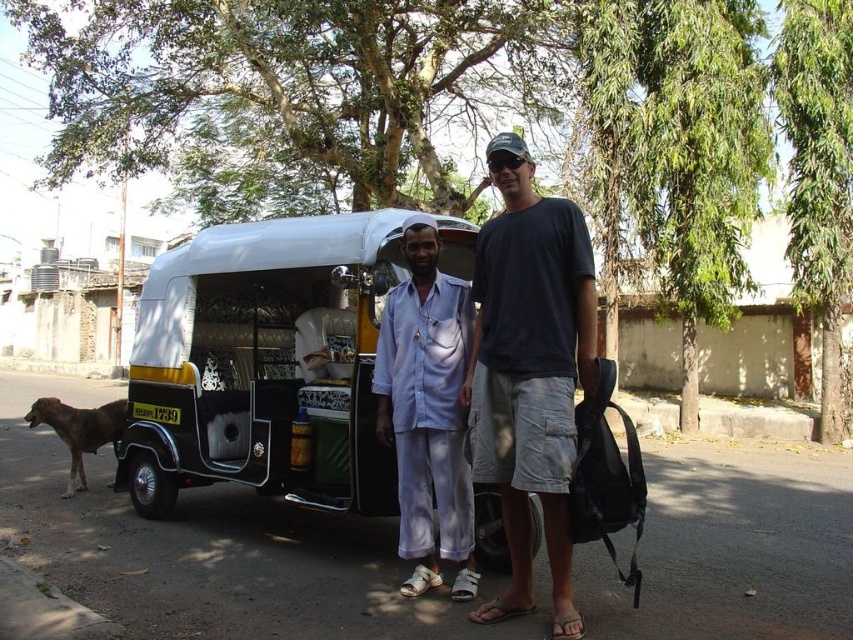
Question: Does dark gray t-shirt at center have a lesser width compared to light blue cotton shirt at center?

Choices:
 (A) no
 (B) yes

Answer: (A)

Question: Does white matte auto-rickshaw at center lie behind light blue cotton shirt at center?

Choices:
 (A) yes
 (B) no

Answer: (A)

Question: In this image, where is white matte auto-rickshaw at center located relative to brown fur dog at lower left?

Choices:
 (A) below
 (B) above

Answer: (B)

Question: Which object is positioned closest to the white matte auto-rickshaw at center?

Choices:
 (A) light blue cotton shirt at center
 (B) brown fur dog at lower left

Answer: (A)

Question: Considering the real-world distances, which object is farthest from the white matte auto-rickshaw at center?

Choices:
 (A) light blue cotton shirt at center
 (B) dark gray t-shirt at center
 (C) brown fur dog at lower left

Answer: (C)

Question: Based on their relative distances, which object is farther from the white matte auto-rickshaw at center?

Choices:
 (A) dark gray t-shirt at center
 (B) brown fur dog at lower left
 (C) light blue cotton shirt at center

Answer: (B)